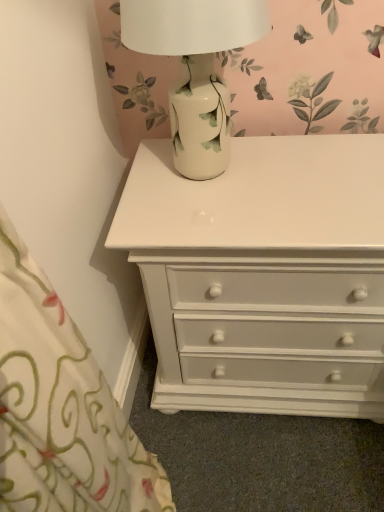
Find the location of `vacant area situated below porcelain vase at upper center (from a real-world perspective)`. vacant area situated below porcelain vase at upper center (from a real-world perspective) is located at coordinates (214, 174).